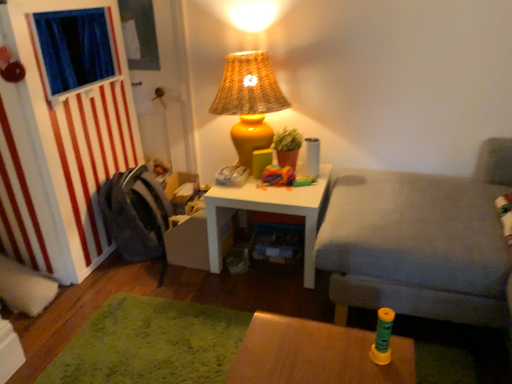
Identify the location of space that is in front of gray fabric swivel chair at left. (126, 278).